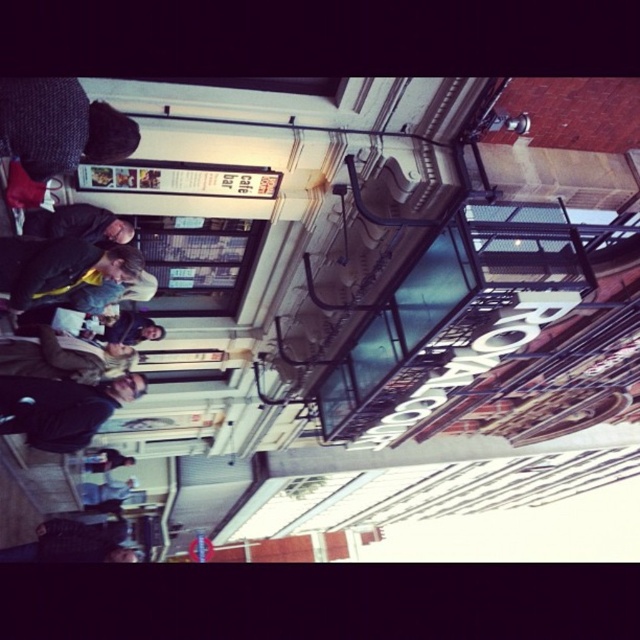
Is dark blue jacket at lower left smaller than matte black jacket at lower left?

Incorrect, dark blue jacket at lower left is not smaller in size than matte black jacket at lower left.

Can you confirm if dark blue jacket at lower left is thinner than matte black jacket at lower left?

No, dark blue jacket at lower left is not thinner than matte black jacket at lower left.

You are a GUI agent. You are given a task and a screenshot of the screen. Output one action in this format:
    pyautogui.click(x=<x>, y=<y>)
    Task: Click on the dark blue jacket at lower left
    
    Given the screenshot: What is the action you would take?
    pyautogui.click(x=61, y=408)

Can you confirm if knitted dark gray hat at upper left is positioned to the left of matte black jacket at lower left?

Incorrect, knitted dark gray hat at upper left is not on the left side of matte black jacket at lower left.

Consider the image. Between knitted dark gray hat at upper left and matte black jacket at lower left, which one has less height?

matte black jacket at lower left is shorter.

Who is more distant from viewer, (45, 147) or (60, 214)?

The point (60, 214) is more distant.

This screenshot has height=640, width=640. Find the location of `knitted dark gray hat at upper left`. knitted dark gray hat at upper left is located at coordinates (60, 125).

Does knitted dark gray hat at upper left have a greater width compared to dark blue jacket at lower left?

No, knitted dark gray hat at upper left is not wider than dark blue jacket at lower left.

Where is `knitted dark gray hat at upper left`? The image size is (640, 640). knitted dark gray hat at upper left is located at coordinates (60, 125).

Between point (54, 80) and point (115, 392), which one is positioned in front?

Positioned in front is point (54, 80).

Locate an element on the screen. knitted dark gray hat at upper left is located at coordinates (60, 125).